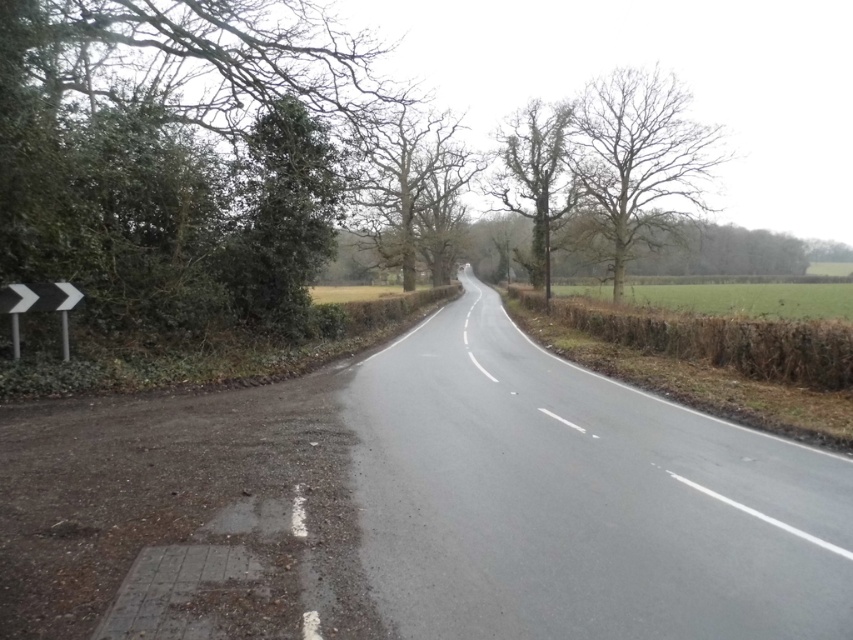
Question: Which object is closer to the camera taking this photo?

Choices:
 (A) bare wood tree at upper right
 (B) white plastic arrow at left
 (C) green leafy tree at center
 (D) bare branches at center

Answer: (B)

Question: Which of the following is the closest to the observer?

Choices:
 (A) (584, 145)
 (B) (357, 193)
 (C) (561, 150)

Answer: (B)

Question: Which is nearer to the white plastic arrow at left?

Choices:
 (A) bare branches at center
 (B) green leafy tree at center

Answer: (A)

Question: Where is green leafy tree at center located in relation to white plastic arrow at left in the image?

Choices:
 (A) right
 (B) left

Answer: (A)

Question: Is bare branches at center below white plastic arrow at left?

Choices:
 (A) yes
 (B) no

Answer: (B)

Question: Does bare branches at center have a larger size compared to white plastic arrow at left?

Choices:
 (A) yes
 (B) no

Answer: (A)